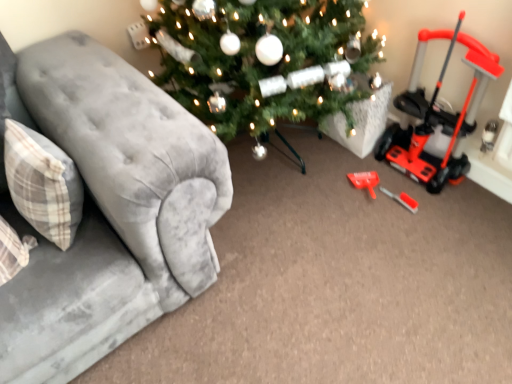
Question: Can you confirm if red plastic screwdriver at lower right is thinner than velvet gray couch at left?

Choices:
 (A) no
 (B) yes

Answer: (B)

Question: Does red plastic screwdriver at lower right appear on the right side of velvet gray couch at left?

Choices:
 (A) yes
 (B) no

Answer: (A)

Question: Does red plastic screwdriver at lower right lie behind velvet gray couch at left?

Choices:
 (A) no
 (B) yes

Answer: (B)

Question: Can we say red plastic screwdriver at lower right lies outside velvet gray couch at left?

Choices:
 (A) no
 (B) yes

Answer: (B)

Question: From the image's perspective, would you say red plastic screwdriver at lower right is shown under velvet gray couch at left?

Choices:
 (A) no
 (B) yes

Answer: (B)

Question: Is red plastic screwdriver at lower right wider or thinner than orange plastic push mower at right?

Choices:
 (A) wide
 (B) thin

Answer: (B)

Question: Relative to orange plastic push mower at right, is red plastic screwdriver at lower right in front or behind?

Choices:
 (A) behind
 (B) front

Answer: (A)

Question: From the image's perspective, is red plastic screwdriver at lower right above or below orange plastic push mower at right?

Choices:
 (A) above
 (B) below

Answer: (B)

Question: Is point (404, 198) positioned closer to the camera than point (408, 140)?

Choices:
 (A) closer
 (B) farther

Answer: (A)

Question: Is red plastic screwdriver at lower right wider or thinner than plaid fabric pillow at left?

Choices:
 (A) thin
 (B) wide

Answer: (A)

Question: From the image's perspective, is red plastic screwdriver at lower right located above or below plaid fabric pillow at left?

Choices:
 (A) below
 (B) above

Answer: (A)

Question: Would you say red plastic screwdriver at lower right is to the left or to the right of plaid fabric pillow at left in the picture?

Choices:
 (A) left
 (B) right

Answer: (B)

Question: Is point (394, 193) positioned closer to the camera than point (10, 144)?

Choices:
 (A) farther
 (B) closer

Answer: (A)

Question: In terms of size, does orange plastic push mower at right appear bigger or smaller than velvet gray couch at left?

Choices:
 (A) big
 (B) small

Answer: (B)

Question: From a real-world perspective, is orange plastic push mower at right positioned above or below velvet gray couch at left?

Choices:
 (A) above
 (B) below

Answer: (B)